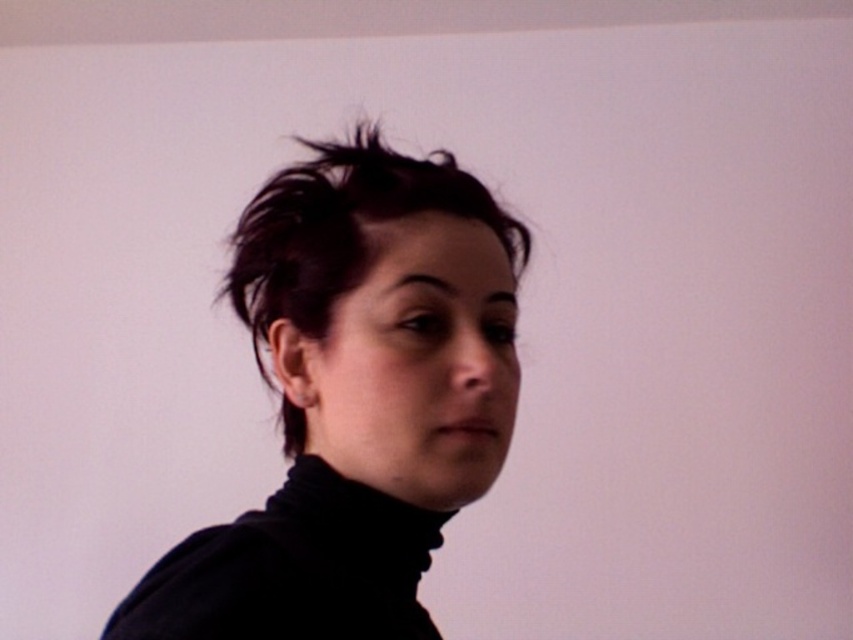
Does matte black face at center appear over black turtleneck at center?

Yes.

Is point (438, 401) positioned behind point (370, 588)?

No.

Locate an element on the screen. The width and height of the screenshot is (853, 640). matte black face at center is located at coordinates (413, 362).

Is matte black turtleneck at center shorter than dark brown hair at center?

Yes, matte black turtleneck at center is shorter than dark brown hair at center.

Which is behind, point (442, 332) or point (410, 195)?

Positioned behind is point (410, 195).

The image size is (853, 640). What are the coordinates of `matte black turtleneck at center` in the screenshot? It's located at (357, 397).

Find the location of a particular element. This screenshot has height=640, width=853. dark brown hair at center is located at coordinates tap(341, 228).

Does point (318, 280) lie in front of point (329, 484)?

Yes, point (318, 280) is in front of point (329, 484).

This screenshot has height=640, width=853. Identify the location of dark brown hair at center. (341, 228).